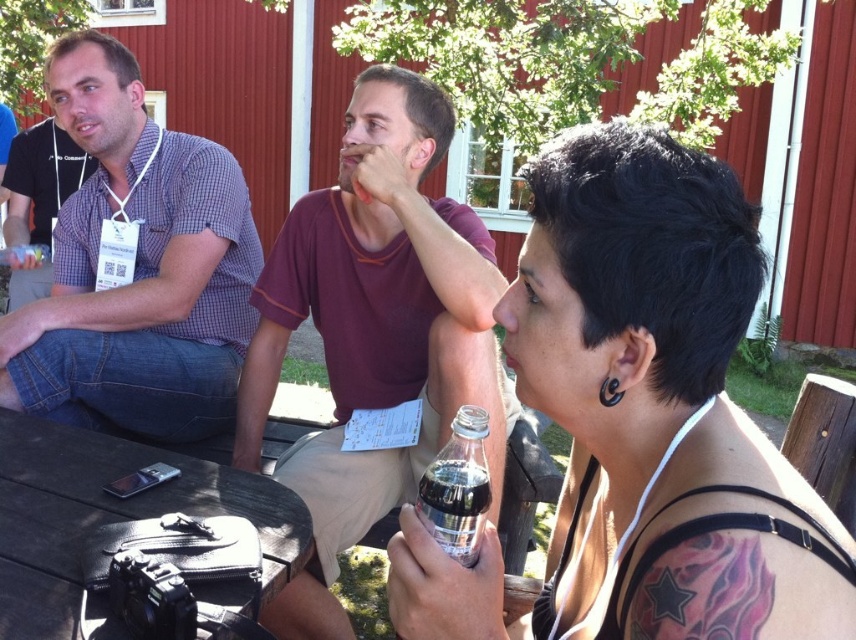
Question: Which point is farther from the camera taking this photo?

Choices:
 (A) (37, 179)
 (B) (455, 428)
 (C) (652, 224)
 (D) (0, 538)

Answer: (A)

Question: Can you confirm if clear plastic bottle at center is positioned above black wood table at lower left?

Choices:
 (A) no
 (B) yes

Answer: (B)

Question: Is maroon cotton shirt at center to the right of clear glass bottle at center from the viewer's perspective?

Choices:
 (A) no
 (B) yes

Answer: (A)

Question: Which point is farther to the camera?

Choices:
 (A) (474, 438)
 (B) (45, 452)
 (C) (718, 472)

Answer: (B)

Question: Which object is farther from the camera taking this photo?

Choices:
 (A) black wood table at lower left
 (B) matte black shirt at left
 (C) checkered fabric shirt at left
 (D) clear plastic bottle at center

Answer: (B)

Question: Does checkered fabric shirt at left have a larger size compared to black wood table at lower left?

Choices:
 (A) no
 (B) yes

Answer: (B)